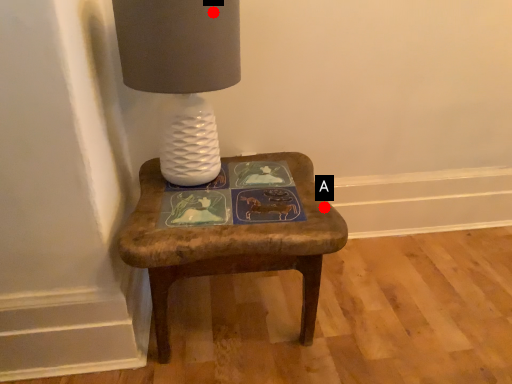
Question: Two points are circled on the image, labeled by A and B beside each circle. Which point is closer to the camera?

Choices:
 (A) A is closer
 (B) B is closer

Answer: (B)